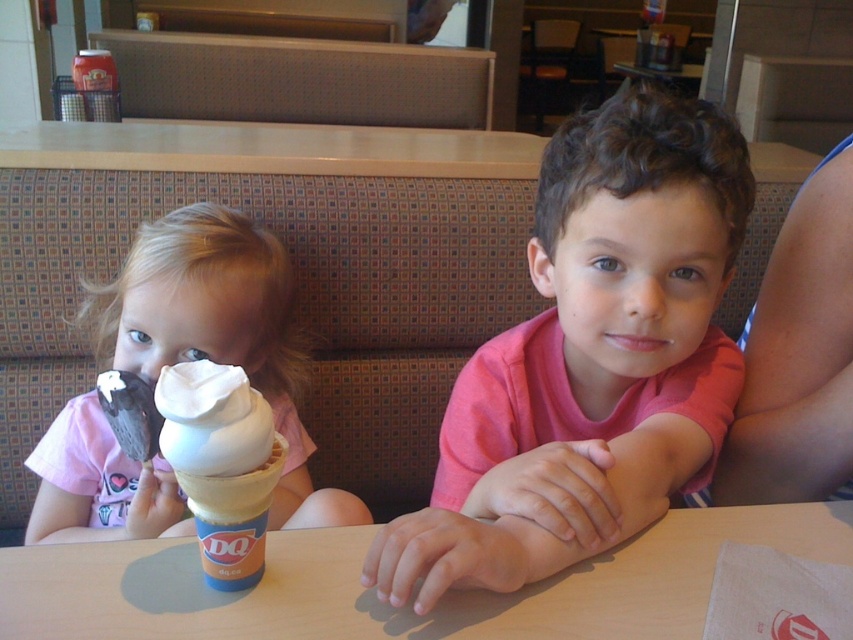
Which is behind, point (553, 264) or point (566, 609)?

Positioned behind is point (553, 264).

Between pink matte shirt at center and smooth wooden table at center, which one appears on the left side from the viewer's perspective?

From the viewer's perspective, smooth wooden table at center appears more on the left side.

Who is more forward, (376, 576) or (299, 637)?

Point (376, 576)

You are a GUI agent. You are given a task and a screenshot of the screen. Output one action in this format:
    pyautogui.click(x=<x>, y=<y>)
    Task: Click on the pink matte shirt at center
    The width and height of the screenshot is (853, 640).
    Given the screenshot: What is the action you would take?
    pyautogui.click(x=590, y=358)

Is smooth wooden table at center above matte white ice cream cone at left?

No, smooth wooden table at center is not above matte white ice cream cone at left.

Who is positioned more to the right, smooth wooden table at center or matte white ice cream cone at left?

smooth wooden table at center

The image size is (853, 640). Find the location of `smooth wooden table at center`. smooth wooden table at center is located at coordinates (389, 605).

Does smooth wooden table at center have a greater height compared to white soft serve ice cream at center?

Incorrect, smooth wooden table at center's height is not larger of white soft serve ice cream at center's.

Can you confirm if smooth wooden table at center is positioned below white soft serve ice cream at center?

Yes.

Which is in front, point (181, 628) or point (215, 563)?

Positioned in front is point (181, 628).

Find the location of `smooth wooden table at center`. smooth wooden table at center is located at coordinates (x=389, y=605).